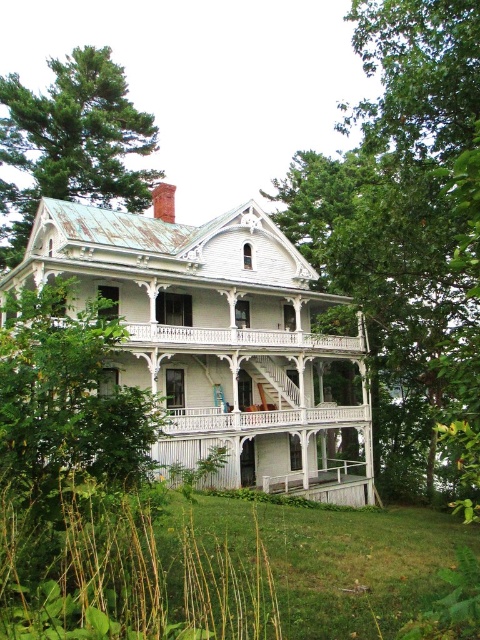
Is green leafy tree at center to the left of green leafy tree at upper left from the viewer's perspective?

No, green leafy tree at center is not to the left of green leafy tree at upper left.

Does green leafy tree at center have a greater height compared to green leafy tree at upper left?

Yes, green leafy tree at center is taller than green leafy tree at upper left.

Between point (450, 161) and point (70, 148), which one is positioned in front?

Point (450, 161) is in front.

Locate an element on the screen. green leafy tree at center is located at coordinates (406, 228).